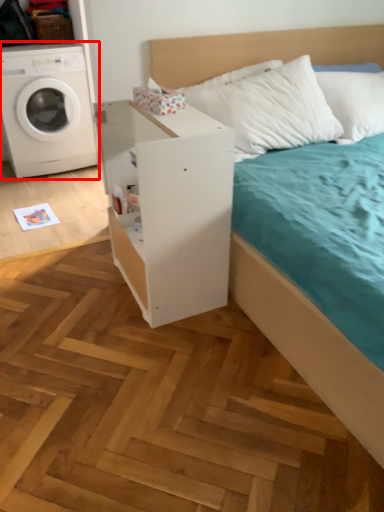
Question: From the image's perspective, where is washing machine (annotated by the red box) located in relation to dresser in the image?

Choices:
 (A) above
 (B) below

Answer: (A)